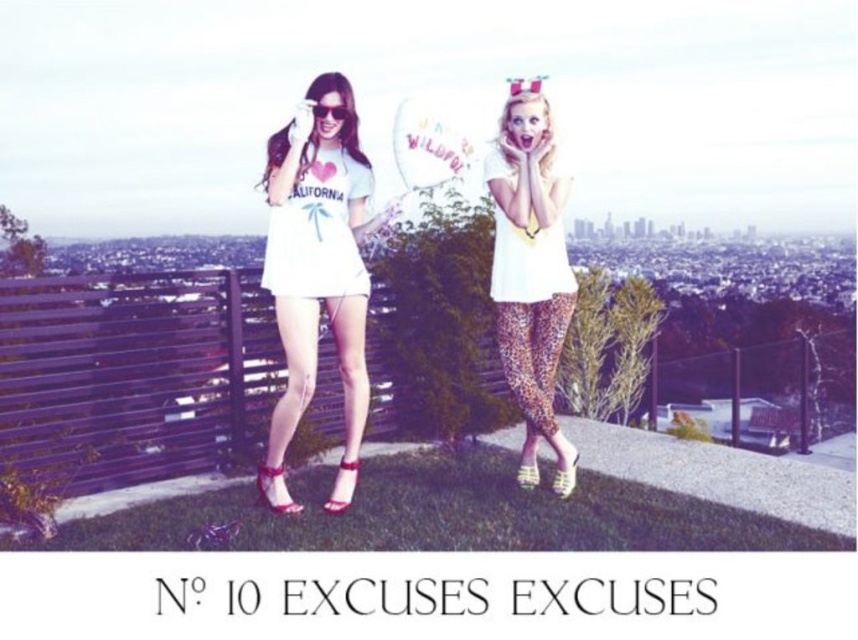
Question: Is leopard print pants at upper right wider than matte black sunglasses at upper center?

Choices:
 (A) no
 (B) yes

Answer: (B)

Question: Which point is farther to the camera?

Choices:
 (A) white matte t-shirt at center
 (B) white leopard print dress at upper right

Answer: (B)

Question: Which object is positioned closest to the white matte dress at center?

Choices:
 (A) white leopard print dress at upper right
 (B) leopard print pants at upper right
 (C) white matte t-shirt at center

Answer: (C)

Question: Can you confirm if white matte dress at center is positioned above matte black sunglasses at upper center?

Choices:
 (A) yes
 (B) no

Answer: (B)

Question: Based on their relative distances, which object is farther from the white matte t-shirt at center?

Choices:
 (A) leopard print pants at upper right
 (B) white leopard print dress at upper right
 (C) white matte dress at center
 (D) matte black sunglasses at upper center

Answer: (A)

Question: Does white matte dress at center lie in front of white leopard print dress at upper right?

Choices:
 (A) yes
 (B) no

Answer: (A)